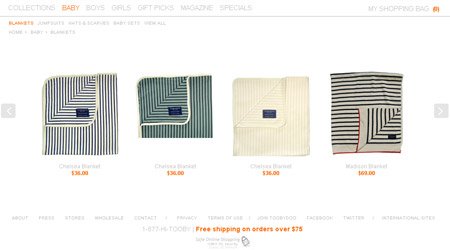
This screenshot has height=250, width=450. What are the coordinates of `blankets` in the screenshot? It's located at (89, 108), (210, 106), (286, 116), (378, 116).